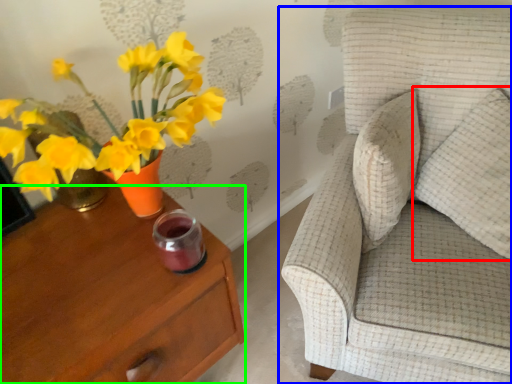
Question: Based on their relative distances, which object is farther from pillow (highlighted by a red box)? Choose from chair (highlighted by a blue box) and nightstand (highlighted by a green box).

Choices:
 (A) chair
 (B) nightstand

Answer: (B)